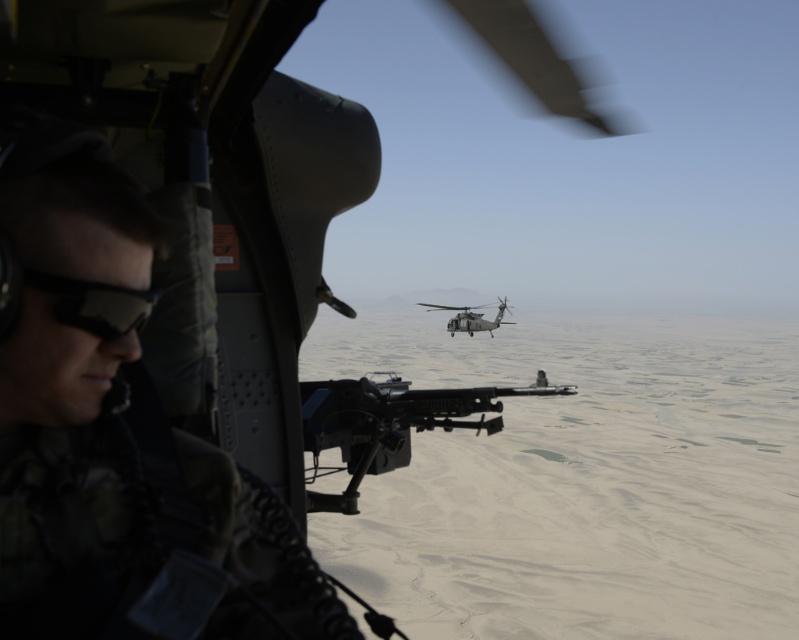
You are a soldier trying to reach a radio on the helicopter wall. The radio is located 22 inches away from the camera. You are wearing the camo fabric uniform at left. Can you comfortably reach the radio without moving your position?

The camo fabric uniform at left is 22.40 inches from the camera. Since the radio is 22 inches away, you are slightly closer to the radio than the uniform, so you can comfortably reach it without moving.

You are a pilot in the helicopter. You need to put on your black matte goggles at left before taking off. Can you reach them from your current position?

The black matte goggles at left is 22.45 inches away from you, so yes, you can reach them from your current position as they are within arm reach.

You are a soldier in the helicopter. You need to grab the matte black rifle at center and the black matte goggles at left. Which object should you reach for first if you want to pick up the one closer to your left side?

The black matte goggles at left are closer to your left side since they are positioned to the left of the matte black rifle at center.